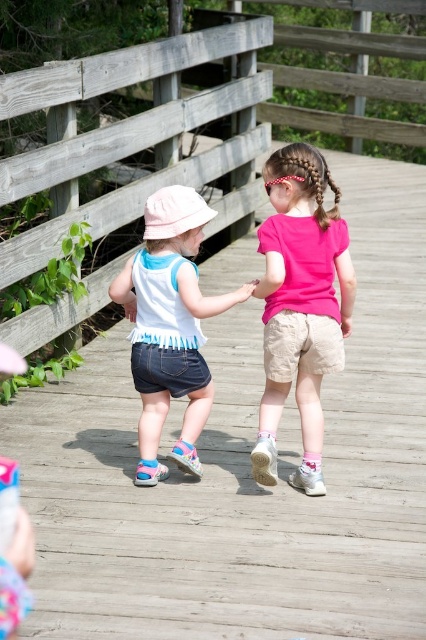
You are a photographer standing on the wooden bridge at center and want to take a photo of the pink matte shorts at center. Which object is closer to your camera lens?

The wooden bridge at center is closer to the camera lens than the pink matte shorts at center because the wooden bridge at center is further to the viewer than pink matte shorts at center.